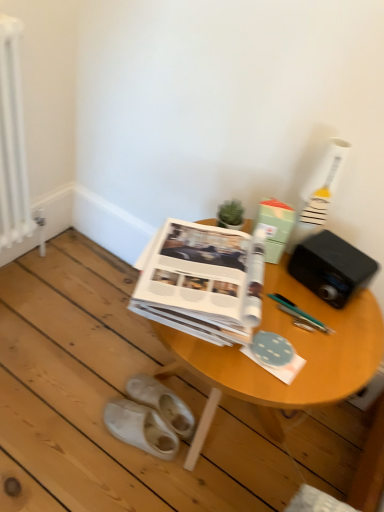
This screenshot has height=512, width=384. In order to click on free space above wooden table at center (from a real-world perspective) in this screenshot , I will do [x=297, y=323].